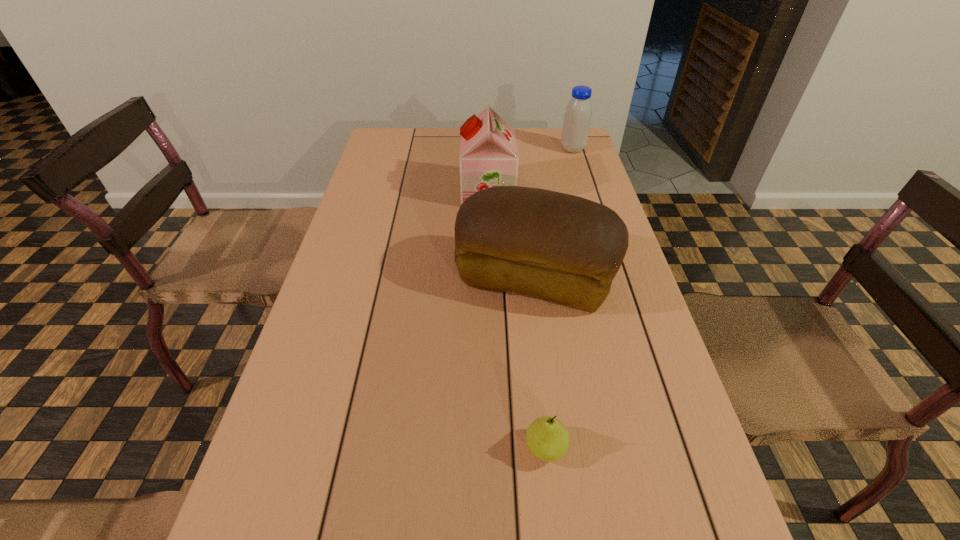
Image resolution: width=960 pixels, height=540 pixels. I want to click on vacant area in the image that satisfies the following two spatial constraints: 1. with the cap open on the bread; 2. on the left side of the nearer soya milk, so coord(490,279).

I want to click on free region that satisfies the following two spatial constraints: 1. on the back side of the right soya milk; 2. on the right side of the third farthest object, so click(517, 149).

What are the coordinates of `free location that satisfies the following two spatial constraints: 1. with the cap open on the nearest object; 2. on the left side of the nearer soya milk` in the screenshot? It's located at (493, 448).

Locate an element on the screen. The width and height of the screenshot is (960, 540). free spot that satisfies the following two spatial constraints: 1. on the front side of the shorter soya milk; 2. with the cap open on the taller soya milk is located at coordinates (586, 192).

At what (x,y) coordinates should I click in order to perform the action: click on vacant space that satisfies the following two spatial constraints: 1. with the cap open on the second farthest object; 2. on the right side of the shortest object. Please return your answer as a coordinate pair (x, y). Looking at the image, I should click on (493, 448).

At what (x,y) coordinates should I click in order to perform the action: click on free space that satisfies the following two spatial constraints: 1. with the cap open on the second farthest object; 2. on the left side of the shortest object. Please return your answer as a coordinate pair (x, y). Looking at the image, I should click on (493, 448).

I want to click on free spot that satisfies the following two spatial constraints: 1. with the cap open on the bread; 2. on the right side of the nearer soya milk, so click(x=490, y=279).